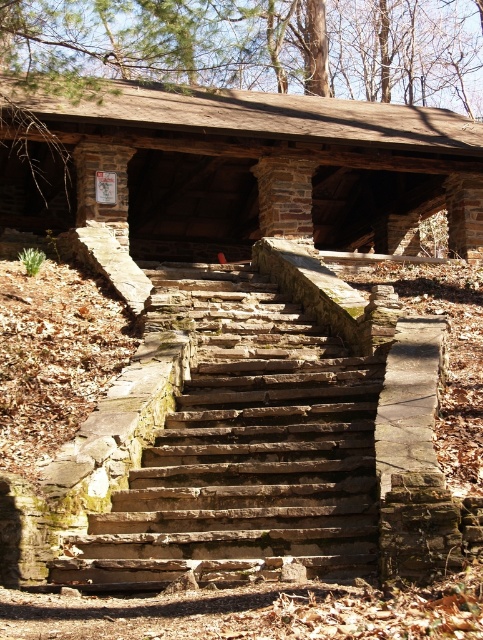
Can you confirm if rusty stone stairs at center is thinner than wooden log cabin at center?

Yes.

Is point (182, 429) closer to camera compared to point (459, 189)?

Yes.

The width and height of the screenshot is (483, 640). Identify the location of rusty stone stairs at center. (243, 451).